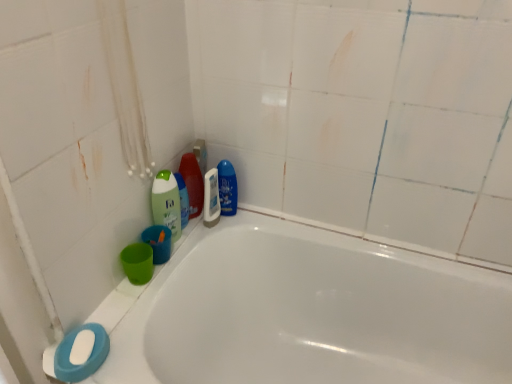
At what (x,y) coordinates should I click in order to perform the action: click on free space to the right of green matte bottle at upper left, the third cleaning product viewed from the right. Please return your answer as a coordinate pair (x, y). This screenshot has width=512, height=384. Looking at the image, I should click on (225, 223).